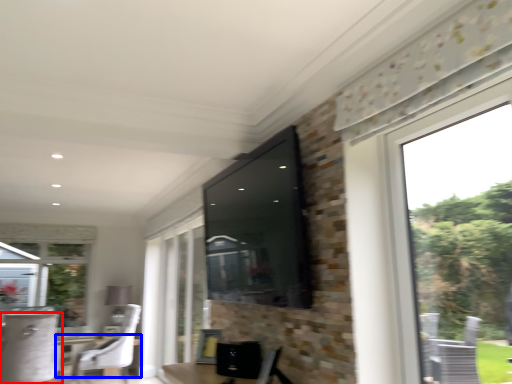
Question: Which point is closer to the camera, chair (highlighted by a red box) or round table (highlighted by a blue box)?

Choices:
 (A) chair
 (B) round table

Answer: (A)